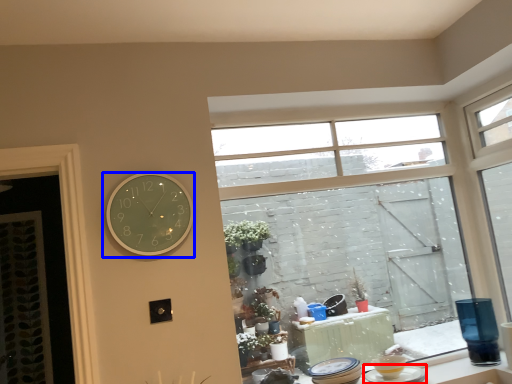
Question: Which object appears closest to the camera in this image, tableware (highlighted by a red box) or wall clock (highlighted by a blue box)?

Choices:
 (A) tableware
 (B) wall clock

Answer: (B)